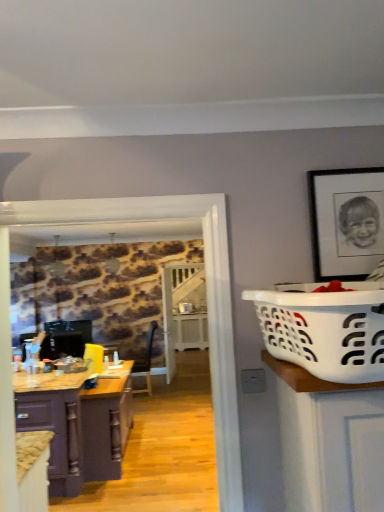
Question: From their relative heights in the image, would you say black matte picture frame at upper right is taller or shorter than matte purple cabinet at lower left, which is counted as the 1th cabinetry, starting from the front?

Choices:
 (A) short
 (B) tall

Answer: (B)

Question: Would you say black matte picture frame at upper right is to the left or to the right of matte purple cabinet at lower left, which is counted as the 1th cabinetry, starting from the front, in the picture?

Choices:
 (A) left
 (B) right

Answer: (B)

Question: Which is nearer to the black matte picture frame at upper right?

Choices:
 (A) purple wood cabinet at left, acting as the 1th cabinetry starting from the back
 (B) white plastic laundry basket at right
 (C) matte purple cabinet at lower left, the 2th cabinetry when ordered from back to front

Answer: (B)

Question: Which object is the farthest from the white plastic laundry basket at right?

Choices:
 (A) black matte picture frame at upper right
 (B) matte purple cabinet at lower left, which is counted as the 1th cabinetry, starting from the front
 (C) purple wood cabinet at left, which appears as the second cabinetry when viewed from the front

Answer: (C)